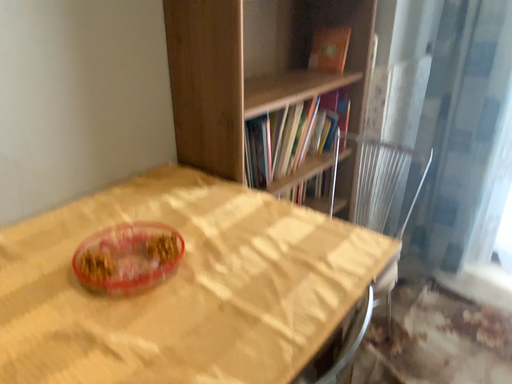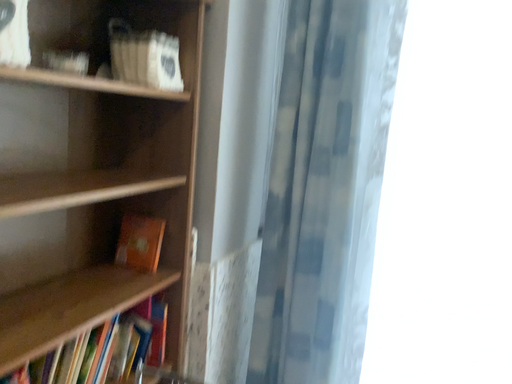
Question: How did the camera likely rotate when shooting the video?

Choices:
 (A) rotated left
 (B) rotated right

Answer: (B)